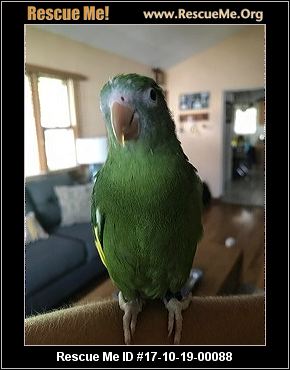
This screenshot has height=370, width=290. Find the location of `windows`. windows is located at coordinates (58, 106), (58, 137).